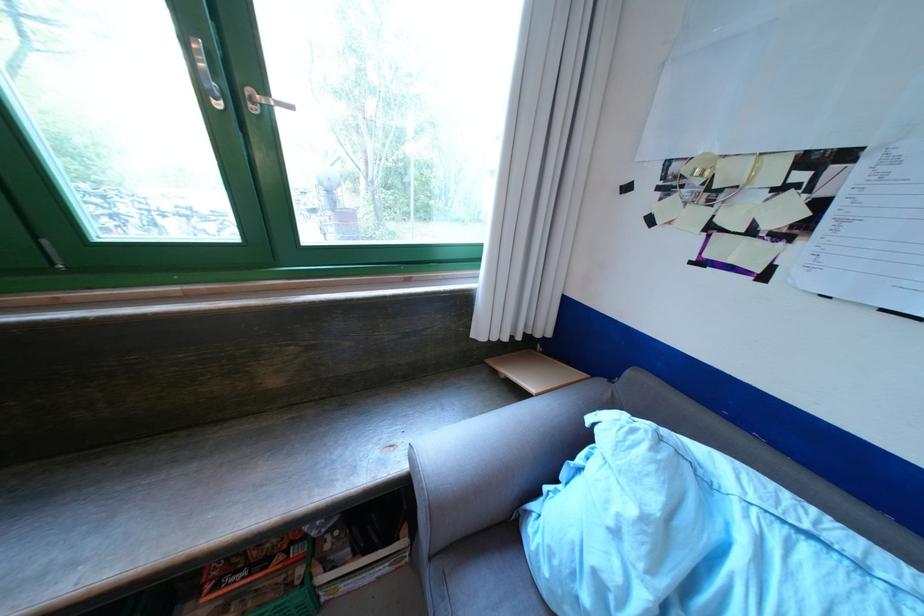
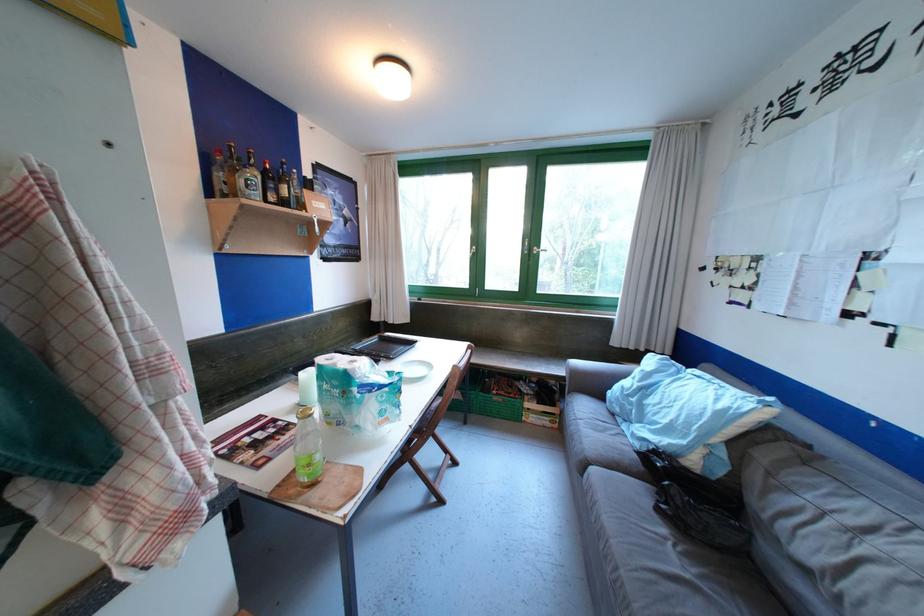
Where in the second image is the point corresponding to point 246,583 from the first image?

(509, 394)